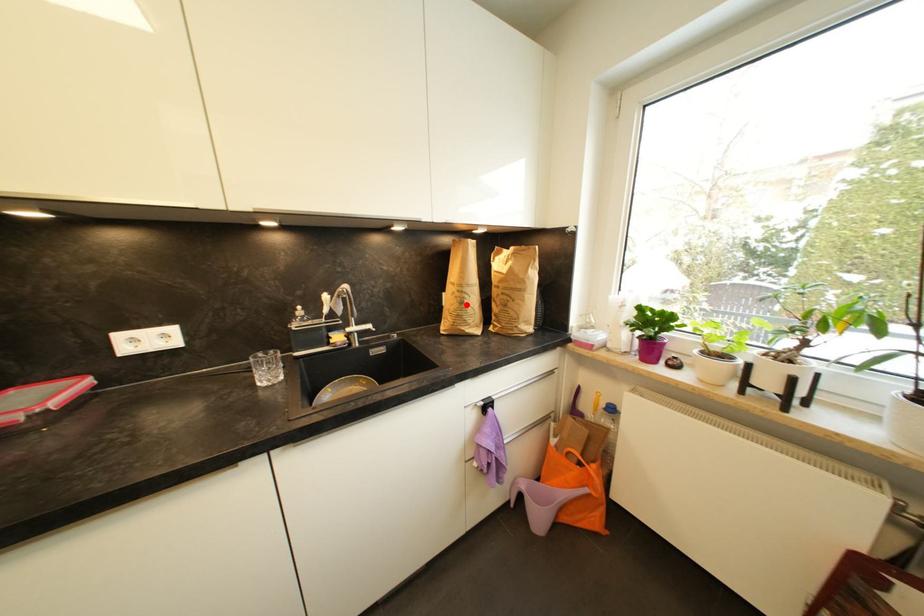
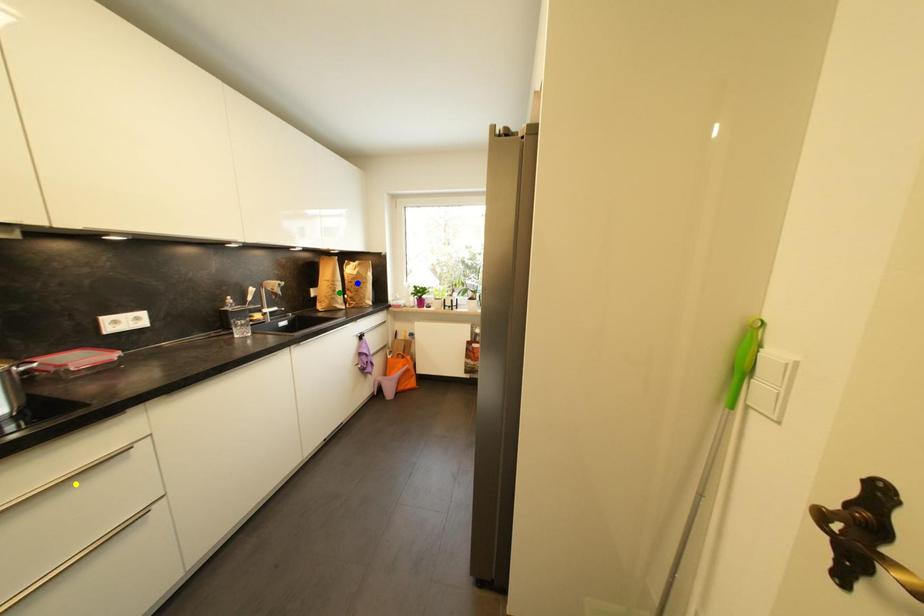
Question: I am providing you with two images of the same scene from different viewpoints. A red point is marked on the first image. You are given multiple points on the second image. Which point in image 2 represents the same 3d spot as the red point in image 1?

Choices:
 (A) blue point
 (B) yellow point
 (C) green point

Answer: (C)